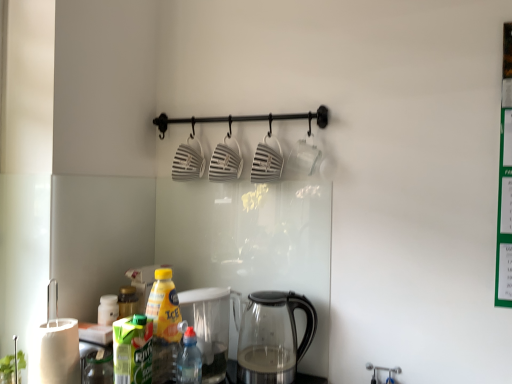
Question: Can you confirm if yellow plastic bottle at lower left, arranged as the first bottle when viewed from the left, is thinner than translucent plastic bottle at lower center, which is the first bottle from right to left?

Choices:
 (A) yes
 (B) no

Answer: (B)

Question: Is the surface of yellow plastic bottle at lower left, placed as the 2th bottle when sorted from right to left, in direct contact with translucent plastic bottle at lower center, which is the first bottle from right to left?

Choices:
 (A) no
 (B) yes

Answer: (B)

Question: From a real-world perspective, is yellow plastic bottle at lower left, arranged as the first bottle when viewed from the left, physically above translucent plastic bottle at lower center, which is the first bottle from right to left?

Choices:
 (A) yes
 (B) no

Answer: (A)

Question: Is yellow plastic bottle at lower left, placed as the 2th bottle when sorted from right to left, smaller than translucent plastic bottle at lower center, arranged as the 2th bottle when viewed from the left?

Choices:
 (A) yes
 (B) no

Answer: (B)

Question: Considering the relative positions of yellow plastic bottle at lower left, placed as the 2th bottle when sorted from right to left, and translucent plastic bottle at lower center, which is the first bottle from right to left, in the image provided, is yellow plastic bottle at lower left, placed as the 2th bottle when sorted from right to left, to the right of translucent plastic bottle at lower center, which is the first bottle from right to left, from the viewer's perspective?

Choices:
 (A) no
 (B) yes

Answer: (A)

Question: Is transparent glass kettle at lower center inside the boundaries of translucent plastic bottle at lower center, which is the first bottle from right to left, or outside?

Choices:
 (A) inside
 (B) outside

Answer: (B)

Question: From a real-world perspective, is transparent glass kettle at lower center above or below translucent plastic bottle at lower center, which is the first bottle from right to left?

Choices:
 (A) above
 (B) below

Answer: (A)

Question: From the image's perspective, relative to translucent plastic bottle at lower center, arranged as the 2th bottle when viewed from the left, is transparent glass kettle at lower center above or below?

Choices:
 (A) below
 (B) above

Answer: (B)

Question: Is point (276, 367) positioned closer to the camera than point (194, 339)?

Choices:
 (A) closer
 (B) farther

Answer: (B)

Question: From the image's perspective, is yellow plastic bottle at lower left, placed as the 2th bottle when sorted from right to left, positioned above or below transparent glass kettle at lower center?

Choices:
 (A) above
 (B) below

Answer: (A)

Question: In terms of width, does yellow plastic bottle at lower left, arranged as the first bottle when viewed from the left, look wider or thinner when compared to transparent glass kettle at lower center?

Choices:
 (A) wide
 (B) thin

Answer: (B)

Question: Do you think yellow plastic bottle at lower left, arranged as the first bottle when viewed from the left, is within transparent glass kettle at lower center, or outside of it?

Choices:
 (A) outside
 (B) inside

Answer: (A)

Question: Relative to transparent glass kettle at lower center, is yellow plastic bottle at lower left, arranged as the first bottle when viewed from the left, in front or behind?

Choices:
 (A) behind
 (B) front

Answer: (B)

Question: Does point (252, 332) appear closer or farther from the camera than point (170, 367)?

Choices:
 (A) farther
 (B) closer

Answer: (A)

Question: From a real-world perspective, is transparent glass kettle at lower center positioned above or below yellow plastic bottle at lower left, arranged as the first bottle when viewed from the left?

Choices:
 (A) above
 (B) below

Answer: (B)